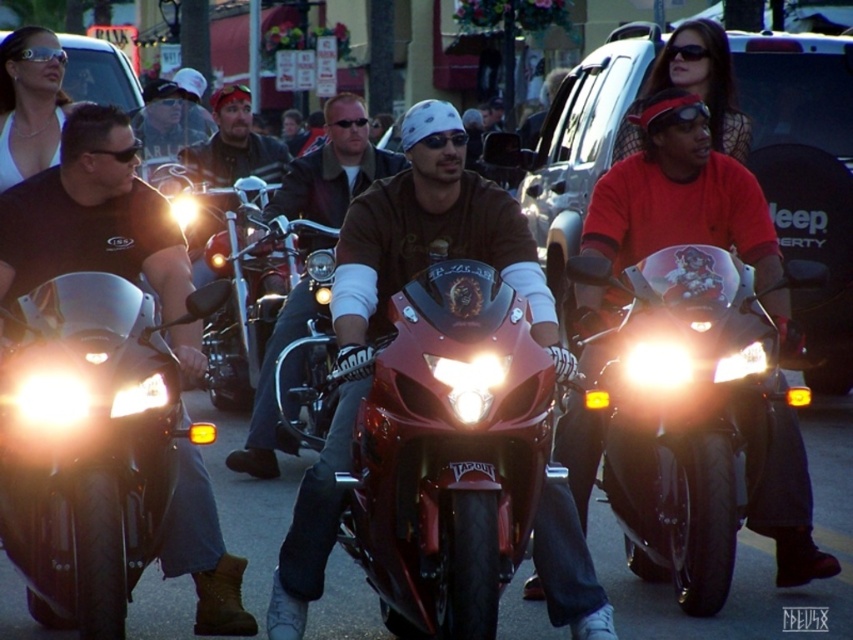
Does shiny chrome motorcycle at left have a lesser height compared to glossy black motorcycle at center?

Correct, shiny chrome motorcycle at left is not as tall as glossy black motorcycle at center.

Describe the element at coordinates (86, 449) in the screenshot. I see `shiny chrome motorcycle at left` at that location.

Where is `shiny chrome motorcycle at left`? shiny chrome motorcycle at left is located at coordinates (86, 449).

Is point (256, 385) less distant than point (149, 112)?

Yes, point (256, 385) is closer to viewer.

Locate an element on the screen. This screenshot has height=640, width=853. matte brown leather jacket at center is located at coordinates (334, 168).

At what (x,y) coordinates should I click in order to perform the action: click on matte brown leather jacket at center. Please return your answer as a coordinate pair (x, y). The width and height of the screenshot is (853, 640). Looking at the image, I should click on click(334, 168).

Between shiny red motorcycle at center and glossy black motorcycle at center, which one appears on the right side from the viewer's perspective?

Positioned to the right is glossy black motorcycle at center.

This screenshot has height=640, width=853. In order to click on shiny red motorcycle at center in this screenshot , I will do [450, 452].

Which is behind, point (437, 611) or point (693, 384)?

The point (693, 384) is behind.

Where is `shiny red motorcycle at center`? Image resolution: width=853 pixels, height=640 pixels. shiny red motorcycle at center is located at coordinates (450, 452).